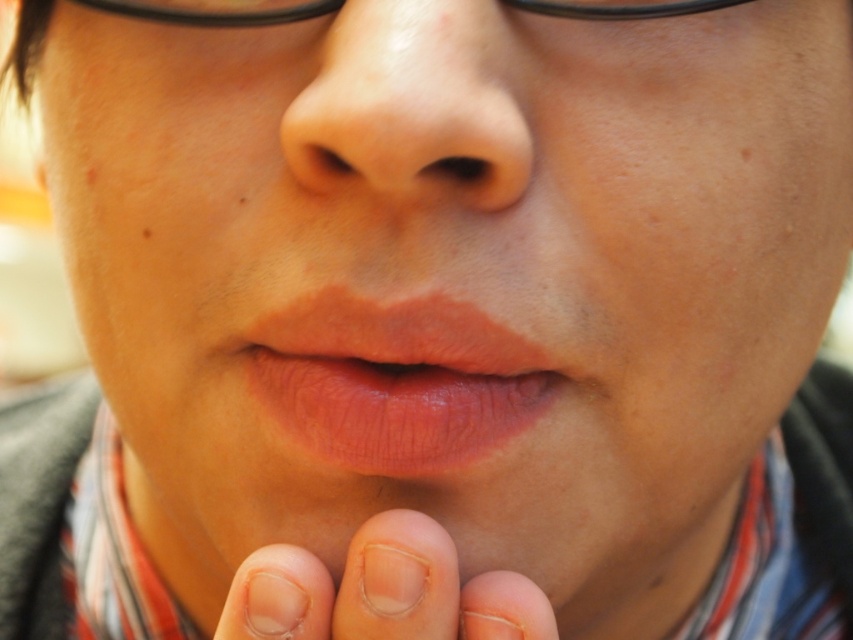
Between point (412, 19) and point (544, 628), which one is positioned behind?

The point (412, 19) is behind.

Who is higher up, smooth skin nose at center or clear skin at lower center?

smooth skin nose at center is above.

At what (x,y) coordinates should I click in order to perform the action: click on smooth skin nose at center. Please return your answer as a coordinate pair (x, y). Looking at the image, I should click on (408, 109).

Is smooth skin nose at center in front of black plastic glasses at upper center?

Yes, smooth skin nose at center is in front of black plastic glasses at upper center.

Can you confirm if smooth skin nose at center is bigger than black plastic glasses at upper center?

No, smooth skin nose at center is not bigger than black plastic glasses at upper center.

Locate an element on the screen. Image resolution: width=853 pixels, height=640 pixels. smooth skin nose at center is located at coordinates (408, 109).

The width and height of the screenshot is (853, 640). In order to click on smooth skin nose at center in this screenshot , I will do `click(408, 109)`.

Can you confirm if clear skin at lower center is thinner than black plastic glasses at upper center?

Indeed, clear skin at lower center has a lesser width compared to black plastic glasses at upper center.

The width and height of the screenshot is (853, 640). What do you see at coordinates (381, 592) in the screenshot?
I see `clear skin at lower center` at bounding box center [381, 592].

I want to click on clear skin at lower center, so click(x=381, y=592).